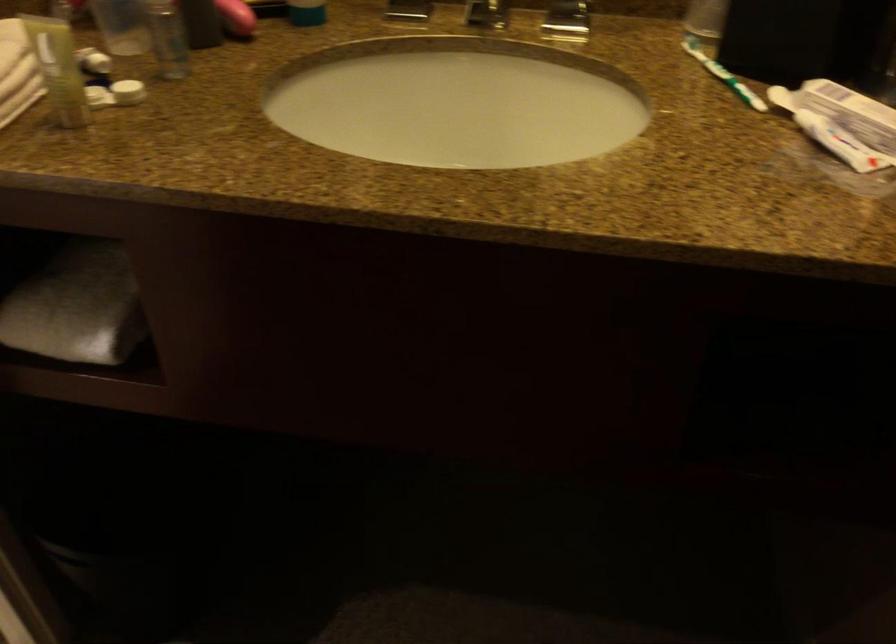
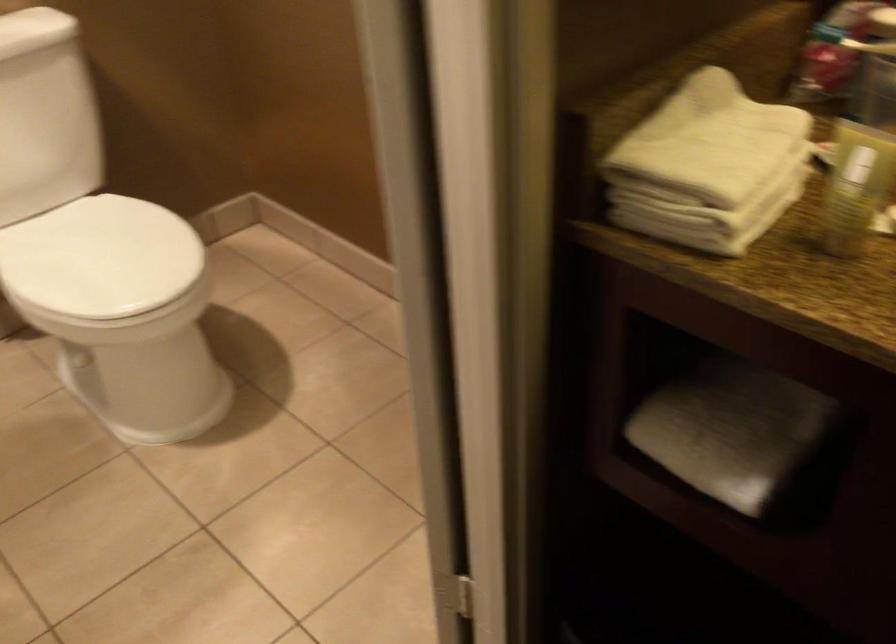
Where in the second image is the point corresponding to the point at 74,301 from the first image?

(730, 431)